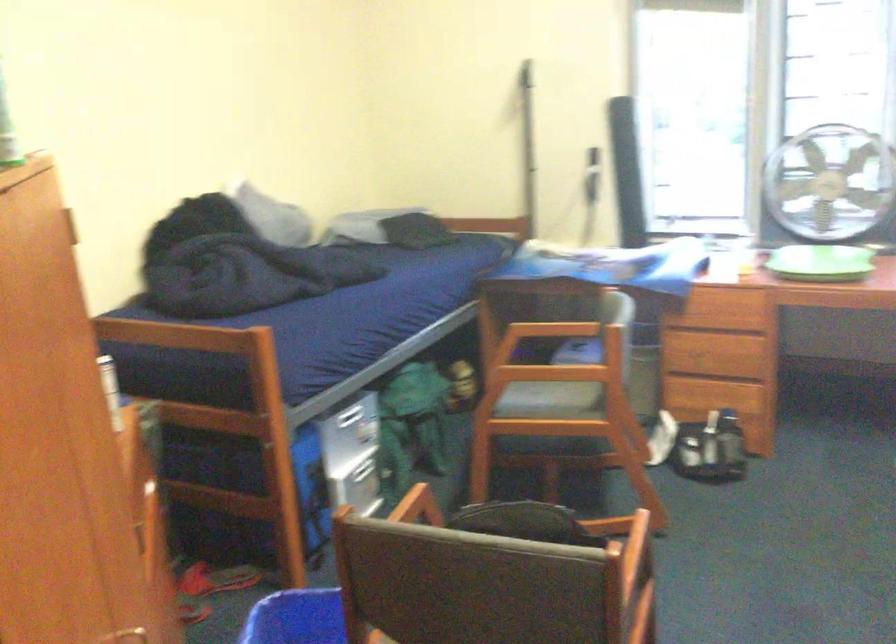
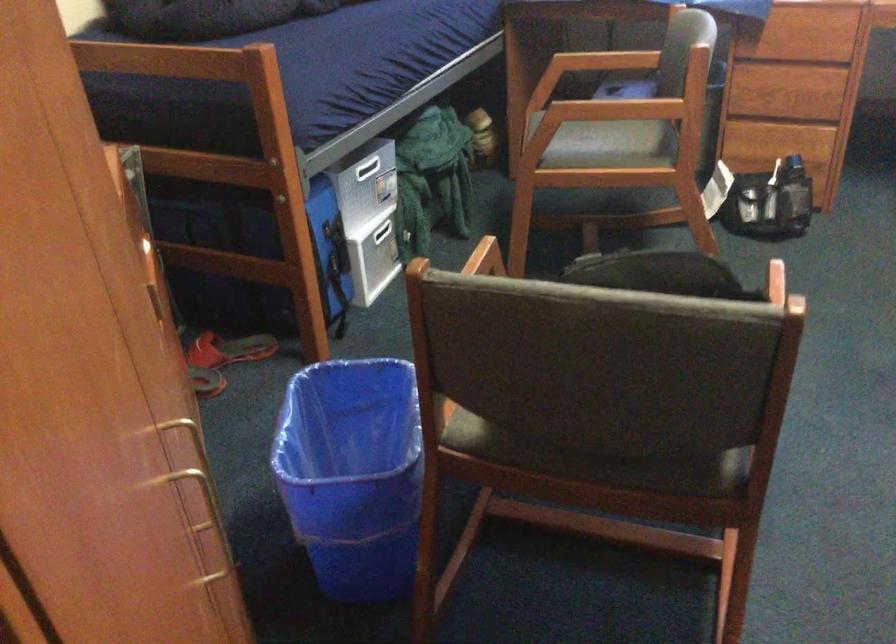
The images are taken continuously from a first-person perspective. In which direction are you moving?

The cameraman walked toward left, forward.